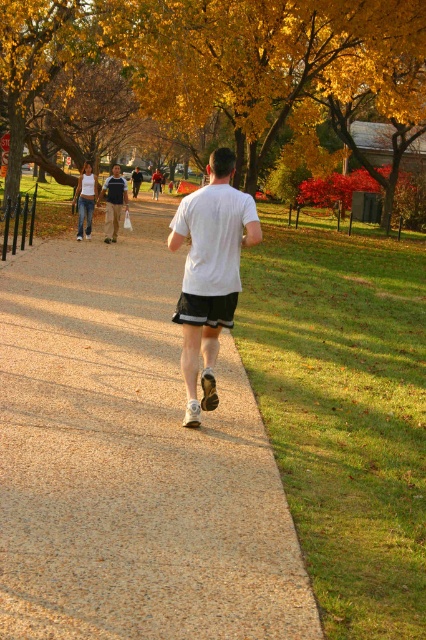
Question: Which object is farther from the camera taking this photo?

Choices:
 (A) white cotton tank top at center
 (B) white matte shirt at center

Answer: (A)

Question: Can you confirm if smooth concrete sidewalk at center is thinner than white matte shirt at center?

Choices:
 (A) yes
 (B) no

Answer: (B)

Question: Which of the following is the farthest from the observer?

Choices:
 (A) (169, 224)
 (B) (28, 440)
 (C) (97, 48)
 (D) (95, 195)

Answer: (D)

Question: Is white matte shirt at center above white cotton tank top at center?

Choices:
 (A) yes
 (B) no

Answer: (B)

Question: Which of the following is the closest to the observer?

Choices:
 (A) white cotton tank top at center
 (B) smooth concrete sidewalk at center

Answer: (B)

Question: Can you confirm if yellow leafy tree at upper center is positioned to the right of white matte shirt at center?

Choices:
 (A) no
 (B) yes

Answer: (B)